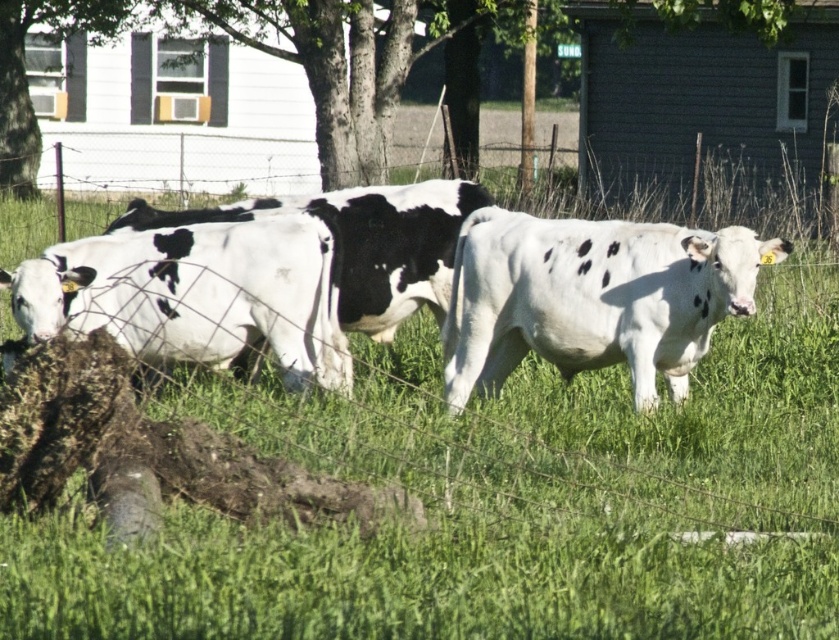
You are standing in the field looking at the cows. There are two points marked in the image. The first point is at coordinate point [530,342] and the second point is at coordinate point [360,86]. Which point is closer to you?

Point [530,342] is closer to the camera than point [360,86], so the first point is closer to you.

You are standing in the field and see the white smooth cow at center and the black and white spotted cow at center. Which cow is closer to you?

The white smooth cow at center is closer to you because it is in front of the black and white spotted cow at center.

You are a farmer checking the field. You notice the white smooth cow at center and the green leafy tree at upper center. Which one takes up more area in the image?

The green leafy tree at upper center takes up more area in the image because it occupies more space than the white smooth cow at center.